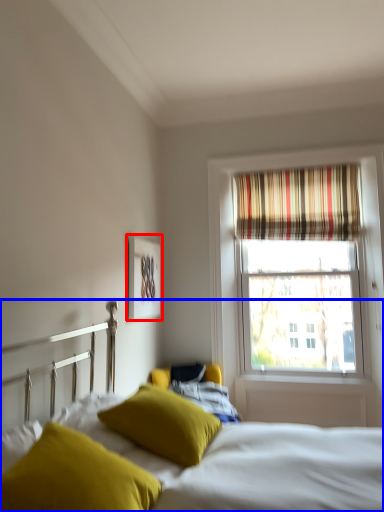
Question: Which point is closer to the camera, picture frame (highlighted by a red box) or bed (highlighted by a blue box)?

Choices:
 (A) picture frame
 (B) bed

Answer: (B)